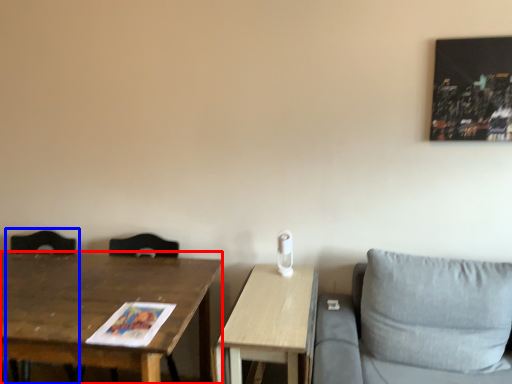
Question: Which point is further to the camera, table (highlighted by a red box) or swivel chair (highlighted by a blue box)?

Choices:
 (A) table
 (B) swivel chair

Answer: (B)